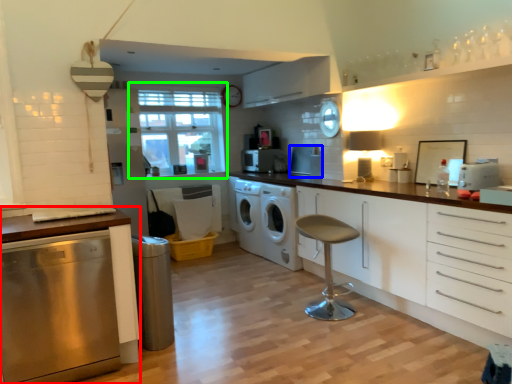
Question: Which object is the closest to the cabinetry (highlighted by a red box)? Choose among these: appliance (highlighted by a blue box) or window (highlighted by a green box).

Choices:
 (A) appliance
 (B) window

Answer: (A)